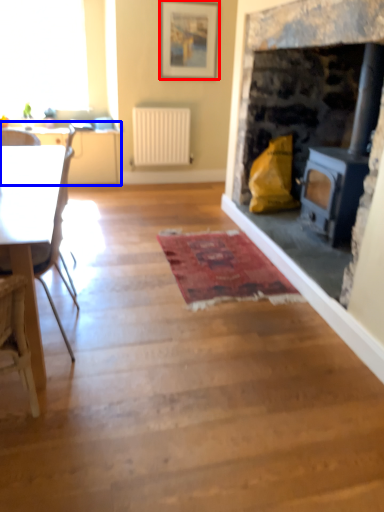
Question: Which object is closer to the camera taking this photo, picture frame (highlighted by a red box) or table (highlighted by a blue box)?

Choices:
 (A) picture frame
 (B) table

Answer: (A)